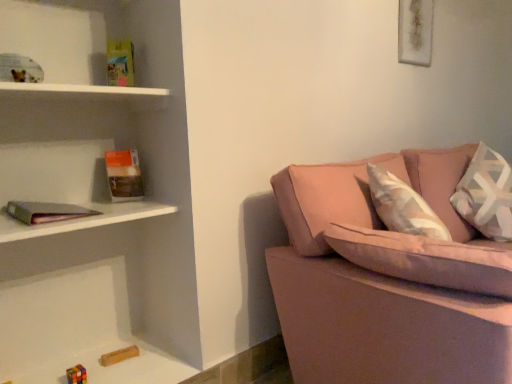
Question: Is hardcover book at left further to camera compared to white textured pillow at right?

Choices:
 (A) no
 (B) yes

Answer: (A)

Question: Is hardcover book at left turned away from white textured pillow at right?

Choices:
 (A) yes
 (B) no

Answer: (B)

Question: From a real-world perspective, is hardcover book at left physically below white textured pillow at right?

Choices:
 (A) no
 (B) yes

Answer: (A)

Question: Can you confirm if hardcover book at left is thinner than white textured pillow at right?

Choices:
 (A) no
 (B) yes

Answer: (B)

Question: Is hardcover book at left positioned before white textured pillow at right?

Choices:
 (A) yes
 (B) no

Answer: (A)

Question: From the image's perspective, relative to hardcover book at left, is matte gray bookshelf at left above or below?

Choices:
 (A) below
 (B) above

Answer: (A)

Question: From a real-world perspective, is matte gray bookshelf at left above or below hardcover book at left?

Choices:
 (A) below
 (B) above

Answer: (A)

Question: Is matte gray bookshelf at left wider or thinner than hardcover book at left?

Choices:
 (A) wide
 (B) thin

Answer: (A)

Question: Considering the positions of matte gray bookshelf at left and hardcover book at left in the image, is matte gray bookshelf at left taller or shorter than hardcover book at left?

Choices:
 (A) short
 (B) tall

Answer: (A)

Question: Is white textured pillow at right spatially inside pink fabric couch at right, or outside of it?

Choices:
 (A) inside
 (B) outside

Answer: (A)

Question: Considering the relative positions of white textured pillow at right and pink fabric couch at right in the image provided, is white textured pillow at right to the left or to the right of pink fabric couch at right?

Choices:
 (A) left
 (B) right

Answer: (B)

Question: Relative to pink fabric couch at right, is white textured pillow at right in front or behind?

Choices:
 (A) behind
 (B) front

Answer: (A)

Question: Is point (478, 178) positioned closer to the camera than point (301, 225)?

Choices:
 (A) closer
 (B) farther

Answer: (B)

Question: From the image's perspective, relative to white textured pillow at right, is hardcover book at left above or below?

Choices:
 (A) above
 (B) below

Answer: (A)

Question: In the image, is hardcover book at left positioned in front of or behind white textured pillow at right?

Choices:
 (A) behind
 (B) front

Answer: (B)